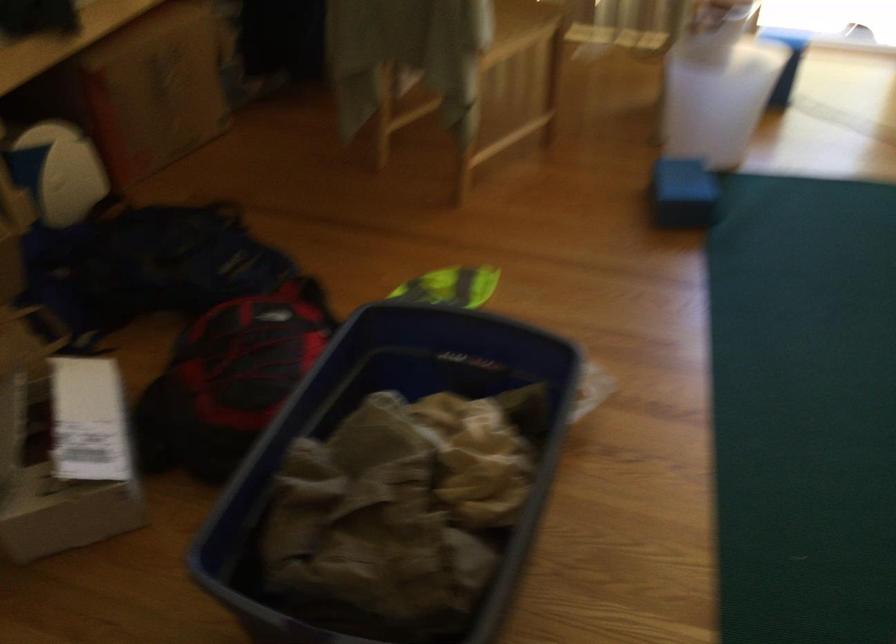
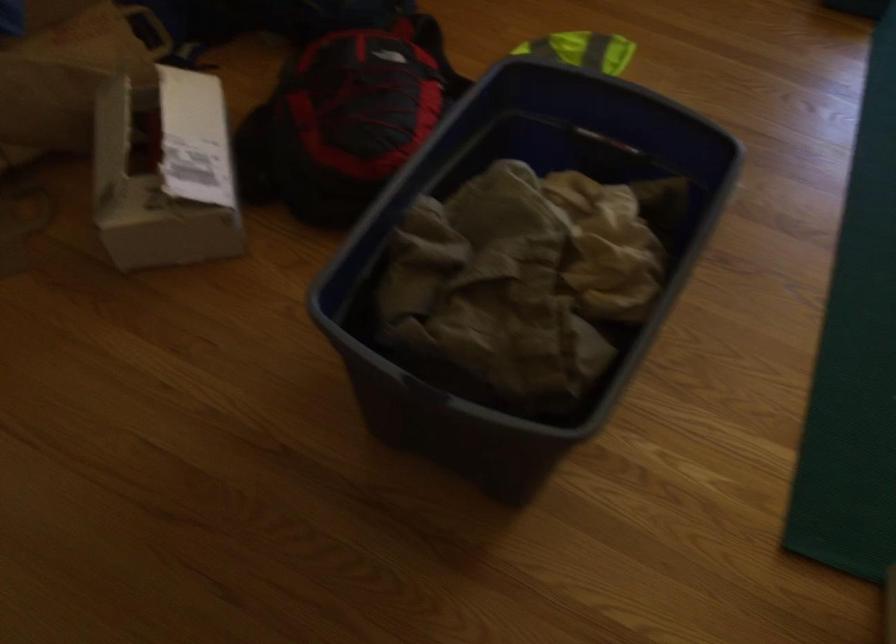
Question: How did the camera likely rotate?

Choices:
 (A) Left
 (B) Right
 (C) Up
 (D) Down

Answer: (D)